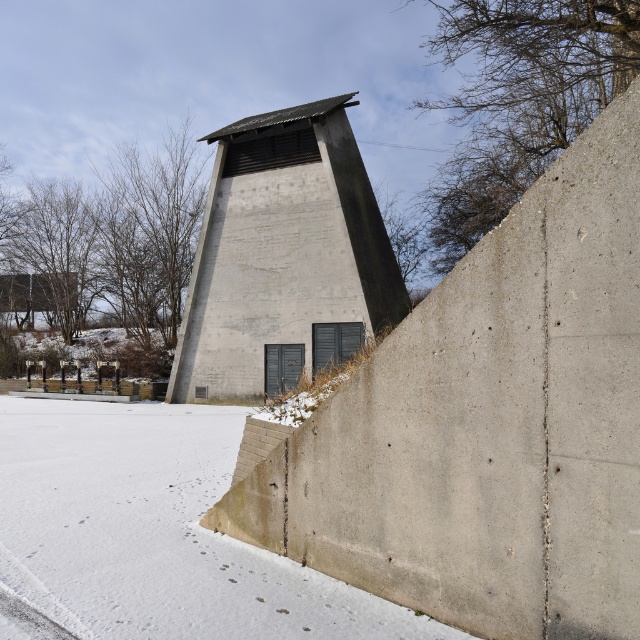
You are standing at the center of the image. Which direction should you walk to reach the white powdery snow at lower left?

You should walk towards the lower left direction to reach the white powdery snow at lower left.

You are a delivery drone with a wingspan of 1.5 meters. You need to fly from the white powdery snow at lower left to the concrete tower at center. Is there enough space between them for you to pass through?

The distance between the white powdery snow at lower left and concrete tower at center is 13.39 meters, so yes, the drone can pass through since its wingspan is only 1.5 meters, which is much smaller than the available space.

You are a delivery person with a cart that is 4 meters wide. You need to move from the white powdery snow at lower left to the doors at the base of the structure. Is there enough space between them for your cart to pass through?

The distance between the white powdery snow at lower left and the doors at the base of the structure is 4.29 meters, so yes, the cart can pass through since it is wider than the cart.